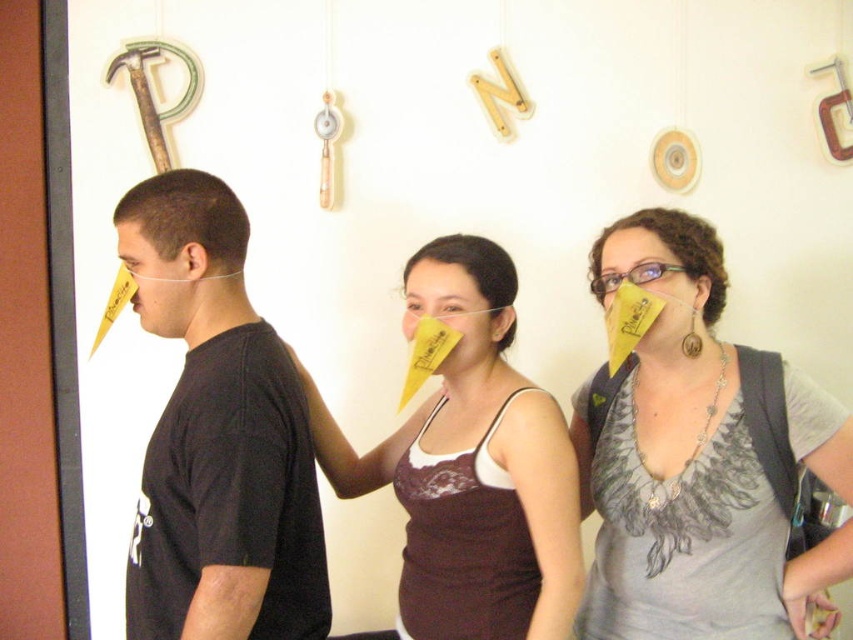
Question: Can you confirm if yellow paper cone at center is positioned below matte yellow paper cone at center?

Choices:
 (A) no
 (B) yes

Answer: (A)

Question: Which point is closer to the camera?

Choices:
 (A) matte yellow paper cone at center
 (B) yellow paper cone at center
 (C) black matte t-shirt at left

Answer: (C)

Question: Can you confirm if yellow paper cone at center is wider than black matte t-shirt at left?

Choices:
 (A) no
 (B) yes

Answer: (B)

Question: Which point is closer to the camera?

Choices:
 (A) black matte t-shirt at left
 (B) yellow paper cone at center
 (C) matte yellow paper cone at center

Answer: (A)

Question: Which object is positioned farthest from the black matte t-shirt at left?

Choices:
 (A) matte yellow paper cone at center
 (B) yellow paper cone at center

Answer: (B)

Question: Can you confirm if yellow paper cone at center is smaller than black matte t-shirt at left?

Choices:
 (A) yes
 (B) no

Answer: (B)